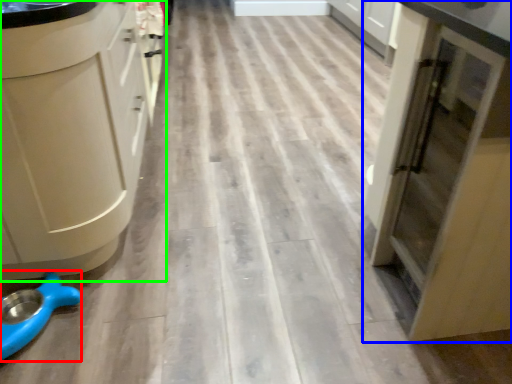
Question: Based on their relative distances, which object is nearer to appliance (highlighted by a red box)? Choose from cupboard (highlighted by a blue box) and cabinetry (highlighted by a green box).

Choices:
 (A) cupboard
 (B) cabinetry

Answer: (B)